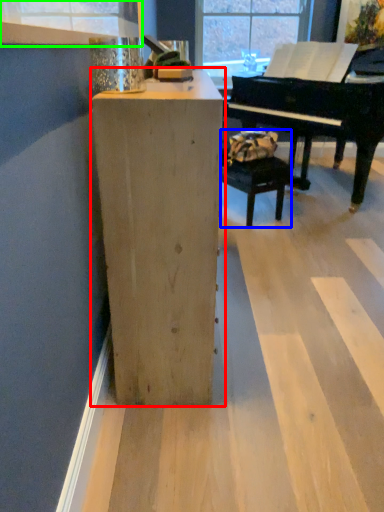
Question: Estimate the real-world distances between objects in this image. Which object is farther from furniture (highlighted by a red box), armchair (highlighted by a blue box) or window frame (highlighted by a green box)?

Choices:
 (A) armchair
 (B) window frame

Answer: (A)